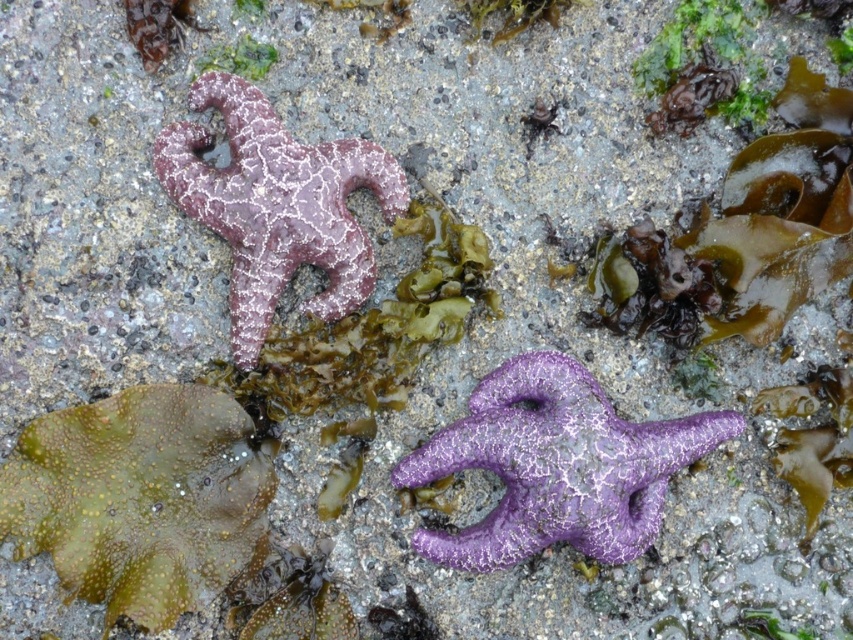
You are a marine biologist examining a tide pool. You notice the purple matte starfish at center and the green matte algae at upper center. Which of these two organisms is bigger in size?

The purple matte starfish at center is larger in size compared to the green matte algae at upper center according to the description.

You are a photographer trying to capture the starfish in the center of the image. You notice two points marked in the scene. Which point, point (x=512, y=516) or point (x=262, y=241), is closer to your camera lens?

Point (x=512, y=516) is closer to the camera than point (x=262, y=241).